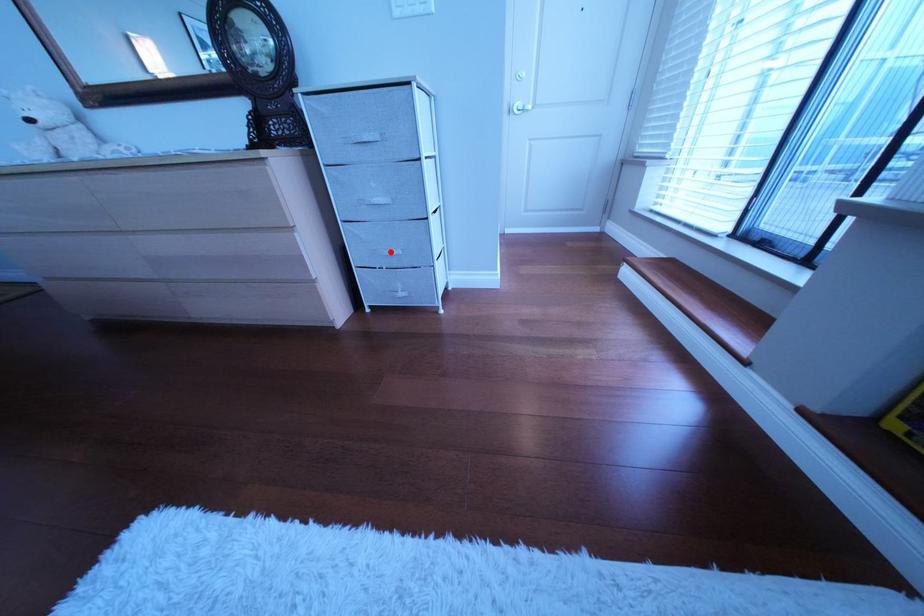
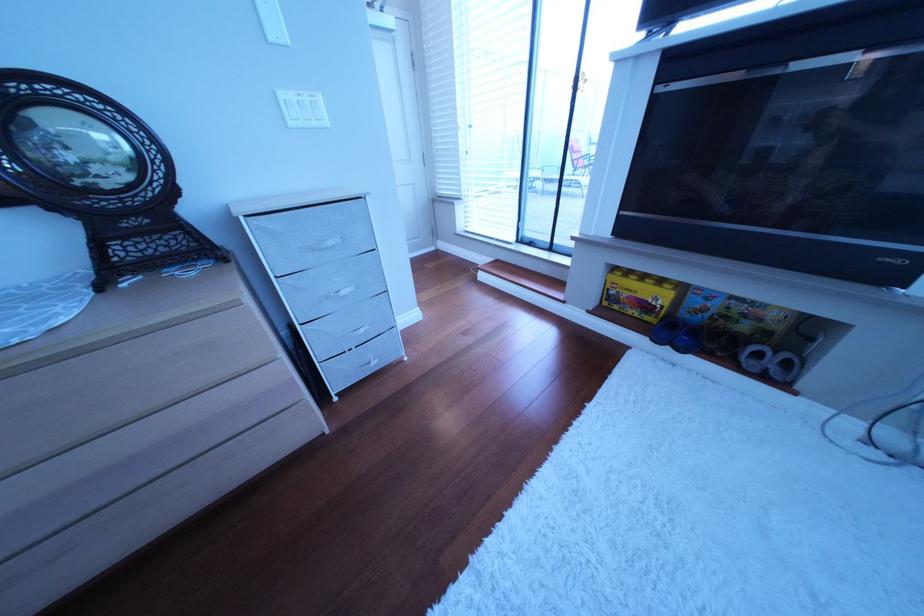
Question: I am providing you with two images of the same scene from different viewpoints. A red point is shown in image1. For the corresponding object point in image2, is it positioned nearer or farther from the camera?

Choices:
 (A) Nearer
 (B) Farther

Answer: (A)